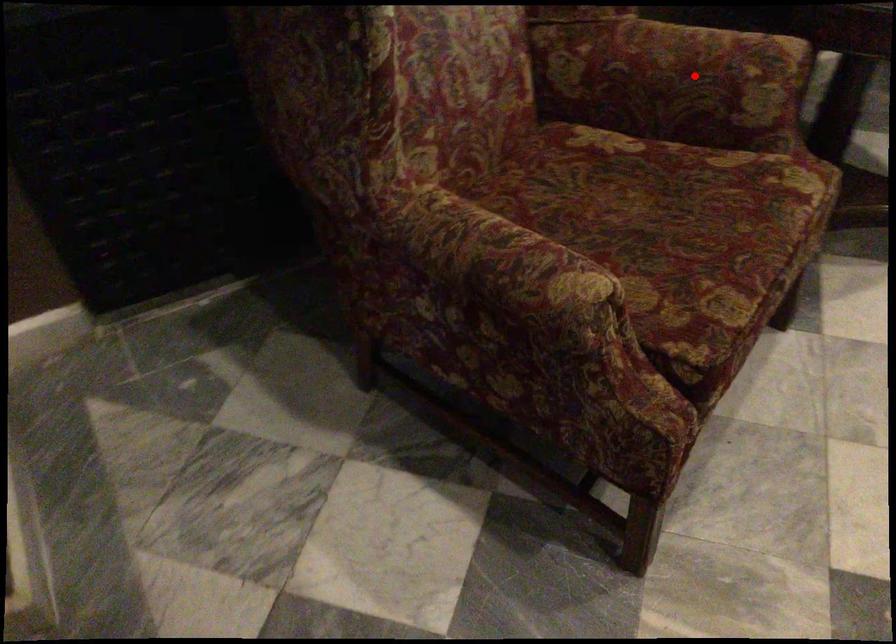
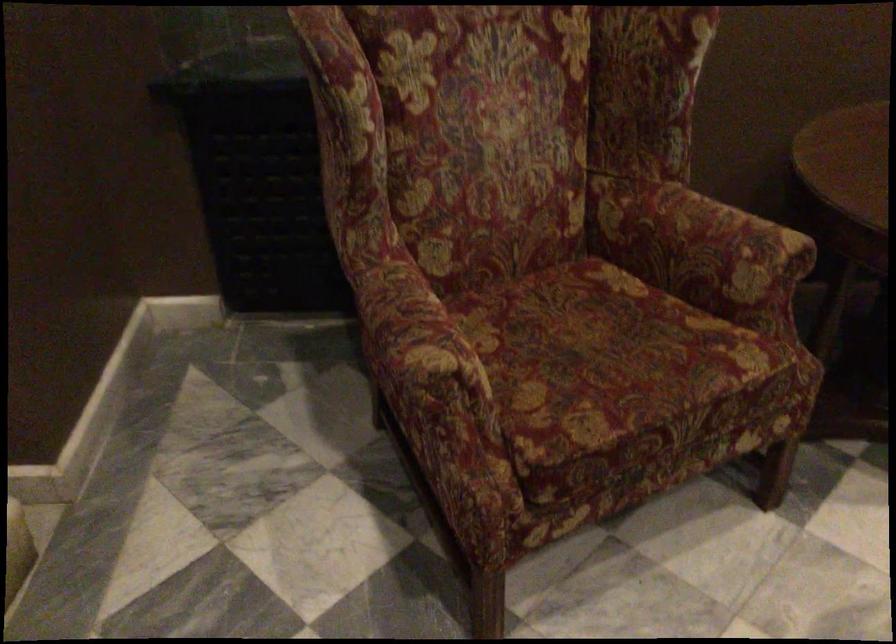
Locate, in the second image, the point that corresponds to the highlighted location in the first image.

(700, 243)